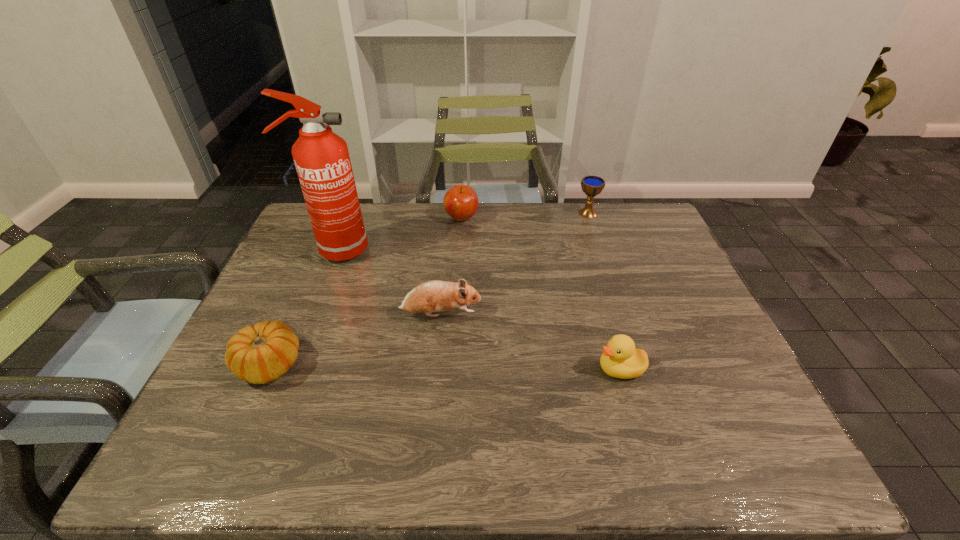
You are a GUI agent. You are given a task and a screenshot of the screen. Output one action in this format:
    pyautogui.click(x=<x>, y=<y>)
    Task: Click on the object situated at the far left corner
    This screenshot has height=540, width=960.
    Given the screenshot: What is the action you would take?
    pyautogui.click(x=321, y=157)

The image size is (960, 540). What are the coordinates of `vacant space at the far edge of the desktop` in the screenshot? It's located at (560, 238).

This screenshot has height=540, width=960. I want to click on free space at the near edge of the desktop, so click(555, 451).

Locate an element on the screen. This screenshot has height=540, width=960. vacant region at the left edge of the desktop is located at coordinates (297, 273).

The image size is (960, 540). I want to click on vacant space at the right edge of the desktop, so click(695, 316).

Locate an element on the screen. The height and width of the screenshot is (540, 960). free space at the far right corner is located at coordinates pyautogui.click(x=620, y=210).

Find the location of a particular element. The height and width of the screenshot is (540, 960). blank region between the fire extinguisher and the hamster is located at coordinates (388, 282).

Identify the location of free space that is in between the gourd and the tallest object. (301, 308).

This screenshot has height=540, width=960. In order to click on blank region between the duckling and the gourd in this screenshot , I will do click(444, 367).

You are a GUI agent. You are given a task and a screenshot of the screen. Output one action in this format:
    pyautogui.click(x=<x>, y=<y>)
    Task: Click on the unoccupied position between the third farthest object and the apple
    The width and height of the screenshot is (960, 540).
    Given the screenshot: What is the action you would take?
    tap(398, 234)